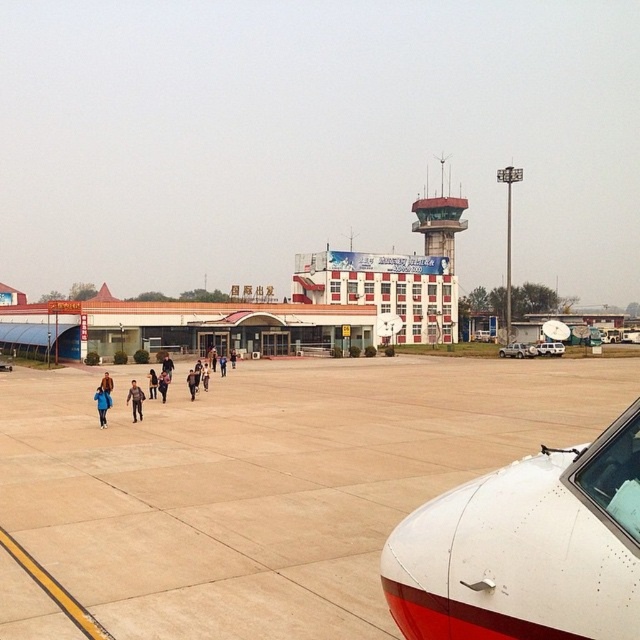
Question: Considering the relative positions of matte red control tower at center and dark blue jacket at center in the image provided, where is matte red control tower at center located with respect to dark blue jacket at center?

Choices:
 (A) above
 (B) below

Answer: (A)

Question: Which of the following is the farthest from the observer?

Choices:
 (A) blue matte jacket at lower left
 (B) dark blue jacket at center

Answer: (B)

Question: Which point is farther to the camera?

Choices:
 (A) dark gray jacket at center
 (B) light brown concrete tarmac at center

Answer: (A)

Question: Which object appears farthest from the camera in this image?

Choices:
 (A) blue matte jacket at lower left
 (B) light brown concrete tarmac at center

Answer: (A)

Question: Is light brown concrete tarmac at center to the left of blue matte jacket at lower left from the viewer's perspective?

Choices:
 (A) no
 (B) yes

Answer: (A)

Question: Observing the image, what is the correct spatial positioning of dark gray jacket at center in reference to blue fabric person at center?

Choices:
 (A) right
 (B) left

Answer: (B)